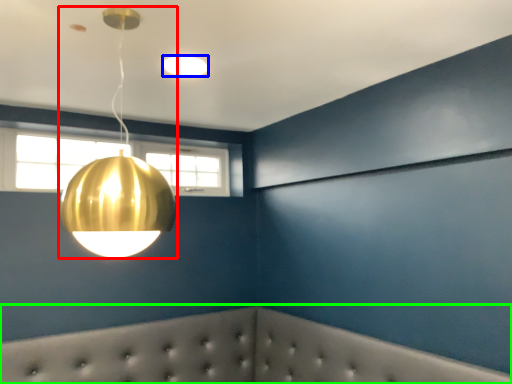
Question: Considering the real-world distances, which object is farthest from lamp (highlighted by a red box)? lamp (highlighted by a blue box) or furniture (highlighted by a green box)?

Choices:
 (A) lamp
 (B) furniture

Answer: (B)